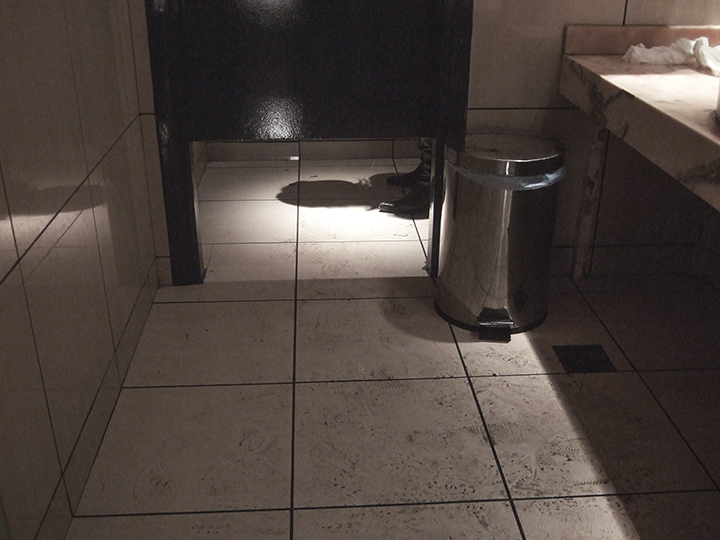
Locate an element on the screen. The image size is (720, 540). tile walls is located at coordinates (510, 42), (45, 110).